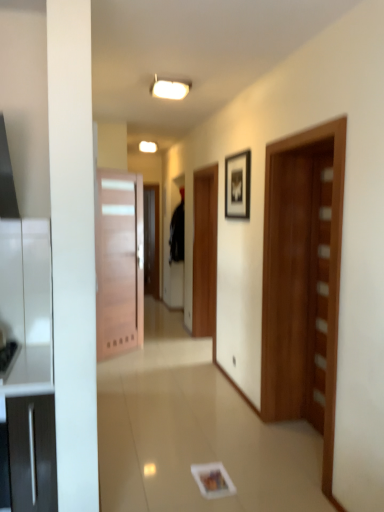
Question: Is black matte picture frame at upper center at the left side of black fabric robe at center?

Choices:
 (A) no
 (B) yes

Answer: (A)

Question: From a real-world perspective, is black matte picture frame at upper center over black fabric robe at center?

Choices:
 (A) yes
 (B) no

Answer: (A)

Question: Can you confirm if black matte picture frame at upper center is bigger than black fabric robe at center?

Choices:
 (A) no
 (B) yes

Answer: (A)

Question: Can black fabric robe at center be found inside black matte picture frame at upper center?

Choices:
 (A) no
 (B) yes

Answer: (A)

Question: Is black matte picture frame at upper center not close to black fabric robe at center?

Choices:
 (A) no
 (B) yes

Answer: (B)

Question: From the image's perspective, would you say black matte picture frame at upper center is positioned over black fabric robe at center?

Choices:
 (A) no
 (B) yes

Answer: (B)

Question: From a real-world perspective, does wooden door at right, the first door viewed from the front, sit lower than wooden door at left, which appears as the 2th door when viewed from the right?

Choices:
 (A) yes
 (B) no

Answer: (B)

Question: From the image's perspective, does wooden door at right, acting as the 2th door starting from the left, appear higher than wooden door at left, the 2th door from the front?

Choices:
 (A) yes
 (B) no

Answer: (B)

Question: Is wooden door at right, acting as the 2th door starting from the left, oriented away from wooden door at left, the 2th door from the front?

Choices:
 (A) no
 (B) yes

Answer: (A)

Question: Could you tell me if wooden door at right, which is counted as the 2th door, starting from the back, is facing wooden door at left, which appears as the 2th door when viewed from the right?

Choices:
 (A) no
 (B) yes

Answer: (A)

Question: From a real-world perspective, is wooden door at right, the first door viewed from the front, positioned over wooden door at left, the 2th door from the front, based on gravity?

Choices:
 (A) yes
 (B) no

Answer: (A)

Question: From the image's perspective, is wooden door at right, the first door viewed from the front, located beneath wooden door at left, which appears as the 2th door when viewed from the right?

Choices:
 (A) yes
 (B) no

Answer: (A)

Question: Is wooden door at right, which is counted as the 2th door, starting from the back, completely or partially outside of black fabric robe at center?

Choices:
 (A) yes
 (B) no

Answer: (A)